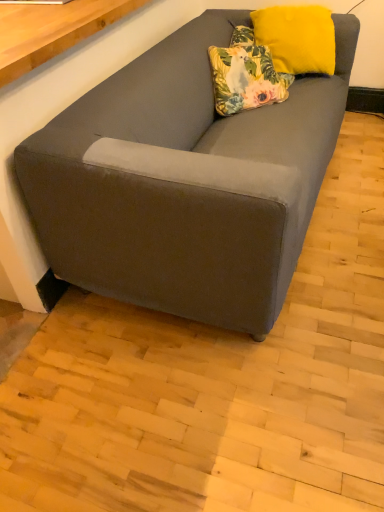
Question: From a real-world perspective, does yellow velvet pillow at upper right, marked as the 1th pillow in a right-to-left arrangement, sit lower than floral fabric pillow at upper center, positioned as the 1th pillow in left-to-right order?

Choices:
 (A) no
 (B) yes

Answer: (A)

Question: Is yellow velvet pillow at upper right, the second pillow from the left, smaller than floral fabric pillow at upper center, positioned as the 1th pillow in left-to-right order?

Choices:
 (A) no
 (B) yes

Answer: (A)

Question: From the image's perspective, is yellow velvet pillow at upper right, the second pillow from the left, under floral fabric pillow at upper center, positioned as the 1th pillow in left-to-right order?

Choices:
 (A) yes
 (B) no

Answer: (B)

Question: Could you tell me if yellow velvet pillow at upper right, the second pillow from the left, is turned towards floral fabric pillow at upper center, the second pillow viewed from the right?

Choices:
 (A) no
 (B) yes

Answer: (A)

Question: Can you confirm if yellow velvet pillow at upper right, marked as the 1th pillow in a right-to-left arrangement, is positioned to the left of floral fabric pillow at upper center, the second pillow viewed from the right?

Choices:
 (A) no
 (B) yes

Answer: (A)

Question: Is yellow velvet pillow at upper right, the second pillow from the left, far away from floral fabric pillow at upper center, the second pillow viewed from the right?

Choices:
 (A) yes
 (B) no

Answer: (B)

Question: Does floral fabric pillow at upper center, the second pillow viewed from the right, have a smaller size compared to suede gray couch at lower left?

Choices:
 (A) yes
 (B) no

Answer: (A)

Question: Is floral fabric pillow at upper center, positioned as the 1th pillow in left-to-right order, shorter than suede gray couch at lower left?

Choices:
 (A) yes
 (B) no

Answer: (A)

Question: From a real-world perspective, is floral fabric pillow at upper center, positioned as the 1th pillow in left-to-right order, beneath suede gray couch at lower left?

Choices:
 (A) no
 (B) yes

Answer: (A)

Question: Is suede gray couch at lower left at the back of floral fabric pillow at upper center, positioned as the 1th pillow in left-to-right order?

Choices:
 (A) no
 (B) yes

Answer: (B)

Question: Is floral fabric pillow at upper center, the second pillow viewed from the right, aimed at suede gray couch at lower left?

Choices:
 (A) yes
 (B) no

Answer: (B)

Question: Would you say floral fabric pillow at upper center, the second pillow viewed from the right, is outside suede gray couch at lower left?

Choices:
 (A) no
 (B) yes

Answer: (B)

Question: Is suede gray couch at lower left further to camera compared to floral fabric pillow at upper center, positioned as the 1th pillow in left-to-right order?

Choices:
 (A) yes
 (B) no

Answer: (B)